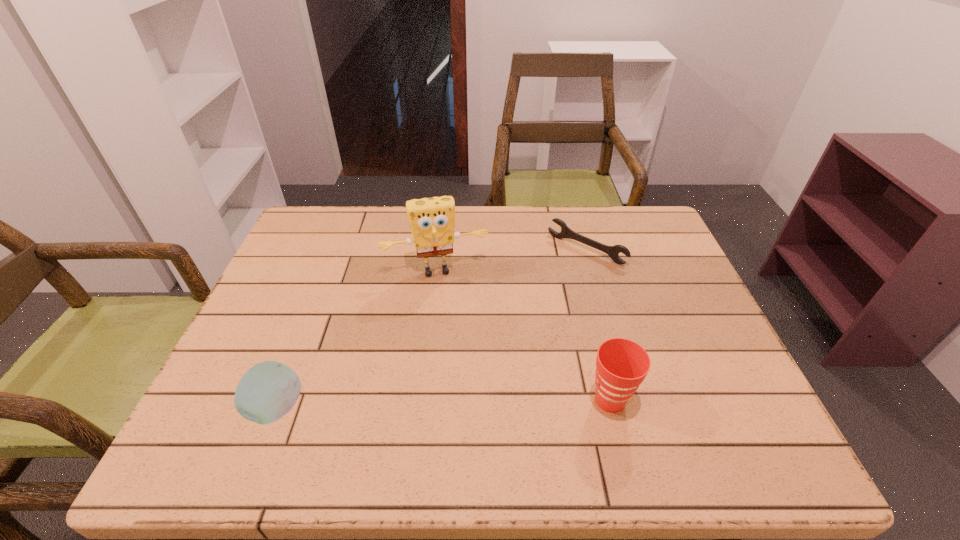
What are the coordinates of `the leftmost object` in the screenshot? It's located at (267, 391).

Identify the location of apple. (267, 391).

Where is `cup`? The width and height of the screenshot is (960, 540). cup is located at coordinates (621, 366).

I want to click on the tallest object, so click(x=432, y=220).

Find the location of a particular element. The height and width of the screenshot is (540, 960). sponge is located at coordinates (432, 220).

Where is `wrench`? wrench is located at coordinates (613, 251).

Where is `blank area located 0.330m on the right of the apple`? The width and height of the screenshot is (960, 540). blank area located 0.330m on the right of the apple is located at coordinates (466, 409).

Where is `free space located 0.150m on the back of the cup`? free space located 0.150m on the back of the cup is located at coordinates [592, 328].

Where is `vacant space located on the face of the tallest object`? The image size is (960, 540). vacant space located on the face of the tallest object is located at coordinates (453, 315).

The height and width of the screenshot is (540, 960). In order to click on vacant space located 0.220m on the face of the tallest object in this screenshot , I will do `click(460, 345)`.